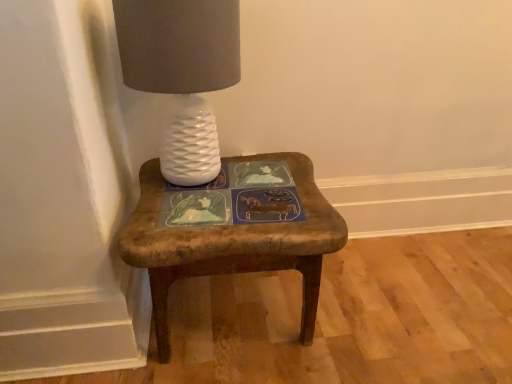
Question: Should I look upward or downward to see white textured lamp at upper left?

Choices:
 (A) up
 (B) down

Answer: (A)

Question: Is wooden stool at center facing towards white textured lamp at upper left?

Choices:
 (A) no
 (B) yes

Answer: (A)

Question: Is the position of wooden stool at center more distant than that of white textured lamp at upper left?

Choices:
 (A) yes
 (B) no

Answer: (A)

Question: Does wooden stool at center appear on the right side of white textured lamp at upper left?

Choices:
 (A) yes
 (B) no

Answer: (A)

Question: From the image's perspective, is wooden stool at center on top of white textured lamp at upper left?

Choices:
 (A) no
 (B) yes

Answer: (A)

Question: From a real-world perspective, is wooden stool at center physically below white textured lamp at upper left?

Choices:
 (A) no
 (B) yes

Answer: (B)

Question: Does wooden stool at center have a lesser width compared to white textured lamp at upper left?

Choices:
 (A) no
 (B) yes

Answer: (A)

Question: Is white textured lamp at upper left to the left of wooden stool at center from the viewer's perspective?

Choices:
 (A) no
 (B) yes

Answer: (B)

Question: From a real-world perspective, is white textured lamp at upper left under wooden stool at center?

Choices:
 (A) no
 (B) yes

Answer: (A)

Question: From a real-world perspective, is white textured lamp at upper left physically above wooden stool at center?

Choices:
 (A) no
 (B) yes

Answer: (B)

Question: From the image's perspective, is white textured lamp at upper left on top of wooden stool at center?

Choices:
 (A) yes
 (B) no

Answer: (A)

Question: Considering the relative positions of white textured lamp at upper left and wooden stool at center in the image provided, is white textured lamp at upper left to the right of wooden stool at center from the viewer's perspective?

Choices:
 (A) no
 (B) yes

Answer: (A)

Question: Is white textured lamp at upper left taller than wooden stool at center?

Choices:
 (A) no
 (B) yes

Answer: (B)

Question: From their relative heights in the image, would you say wooden stool at center is taller or shorter than white textured lamp at upper left?

Choices:
 (A) tall
 (B) short

Answer: (B)